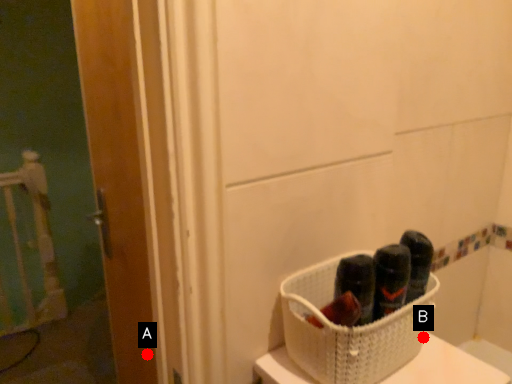
Question: Two points are circled on the image, labeled by A and B beside each circle. Which point is closer to the camera?

Choices:
 (A) A is closer
 (B) B is closer

Answer: (B)